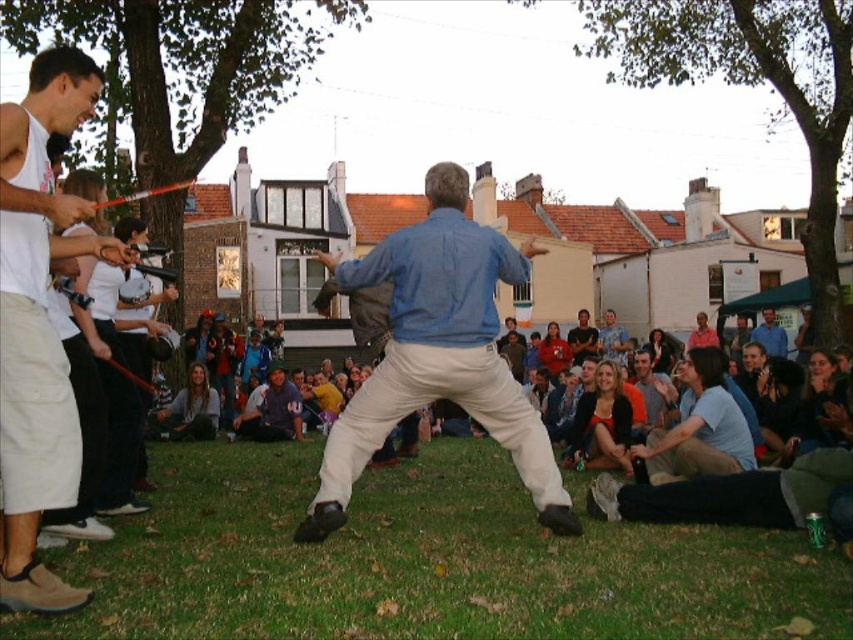
Question: Which object is positioned closest to the green grass at lower center?

Choices:
 (A) blue cotton shirt at center
 (B) white cotton tank top at left

Answer: (A)

Question: Which point is closer to the camera taking this photo?

Choices:
 (A) (456, 401)
 (B) (721, 570)

Answer: (B)

Question: Does green grass at lower center have a larger size compared to blue cotton shirt at center?

Choices:
 (A) yes
 (B) no

Answer: (B)

Question: Estimate the real-world distances between objects in this image. Which object is closer to the blue cotton shirt at center?

Choices:
 (A) white cotton tank top at left
 (B) green grass at lower center

Answer: (B)

Question: Does blue cotton shirt at center appear over white cotton tank top at left?

Choices:
 (A) yes
 (B) no

Answer: (B)

Question: Does green grass at lower center appear under white cotton tank top at left?

Choices:
 (A) no
 (B) yes

Answer: (B)